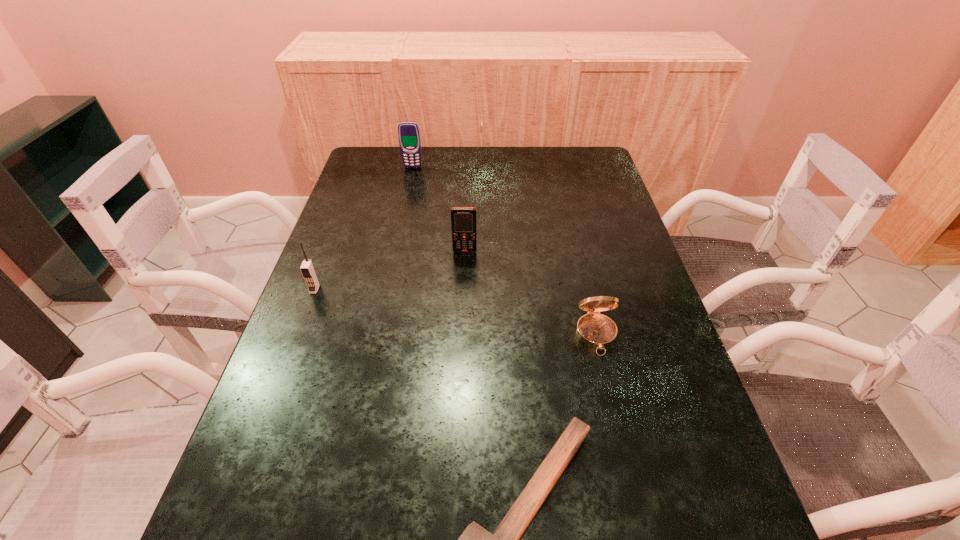
The image size is (960, 540). In order to click on the farthest cellular telephone in this screenshot , I will do `click(409, 136)`.

Identify the location of the fourth object from right to left. (409, 136).

Where is `the second farthest cellular telephone`? The width and height of the screenshot is (960, 540). the second farthest cellular telephone is located at coordinates (463, 219).

Identify the location of the rightmost cellular telephone. The image size is (960, 540). (463, 219).

Identify the location of the leftmost cellular telephone. This screenshot has width=960, height=540. (307, 268).

Identify the location of the nearest cellular telephone. (307, 268).

The width and height of the screenshot is (960, 540). Identify the location of the rightmost object. (596, 331).

You are a GUI agent. You are given a task and a screenshot of the screen. Output one action in this format:
    pyautogui.click(x=<x>, y=<y>)
    Task: Click on the fourth farthest object
    
    Given the screenshot: What is the action you would take?
    pyautogui.click(x=596, y=331)

In order to click on vacant space located 0.280m on the front-facing side of the fourth object from right to left in this screenshot , I will do `click(402, 218)`.

The image size is (960, 540). What are the coordinates of `free space located 0.270m on the screen of the second nearest cellular telephone` in the screenshot? It's located at (462, 332).